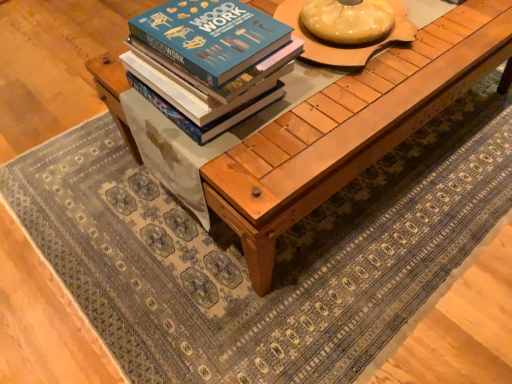
The width and height of the screenshot is (512, 384). Identify the location of free space in front of blue matte book at center. (247, 163).